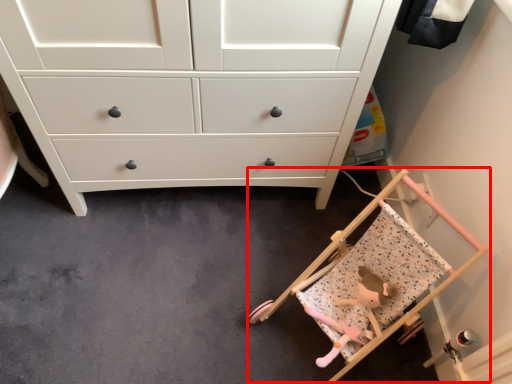
Question: From the image's perspective, where is baby carriage (annotated by the red box) located in relation to toy in the image?

Choices:
 (A) below
 (B) above

Answer: (B)